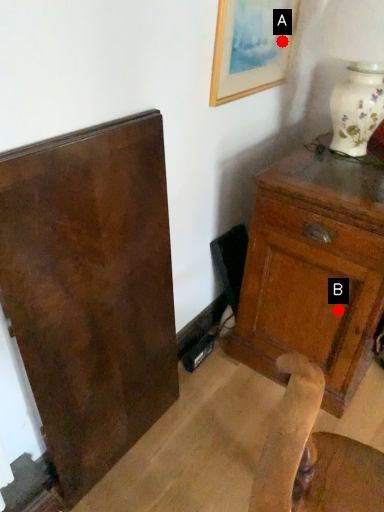
Question: Two points are circled on the image, labeled by A and B beside each circle. Which point is closer to the camera?

Choices:
 (A) A is closer
 (B) B is closer

Answer: (B)